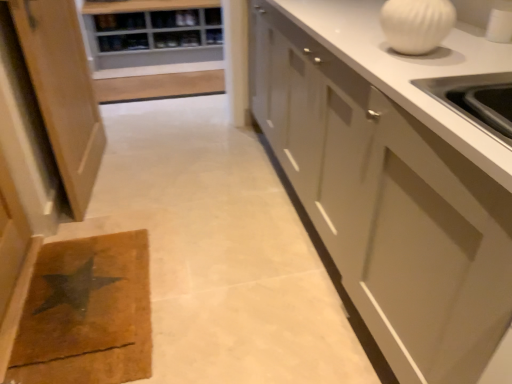
Question: Is white glossy vase at upper right bigger or smaller than wooden shelf at upper center?

Choices:
 (A) small
 (B) big

Answer: (B)

Question: Do you think white glossy vase at upper right is within wooden shelf at upper center, or outside of it?

Choices:
 (A) outside
 (B) inside

Answer: (A)

Question: Considering the real-world distances, which object is farthest from the wooden shelf at upper center?

Choices:
 (A) brown/cork doormat at lower left
 (B) white glossy cabinet at right, which is the second cabinetry in left-to-right order
 (C) light brown wood cabinet at left, the second cabinetry viewed from the right
 (D) white glossy vase at upper right

Answer: (D)

Question: Which object is positioned farthest from the white glossy vase at upper right?

Choices:
 (A) light brown wood cabinet at left, which is counted as the first cabinetry, starting from the left
 (B) brown/cork doormat at lower left
 (C) wooden shelf at upper center
 (D) white glossy cabinet at right, which appears as the 1th cabinetry when viewed from the right

Answer: (C)